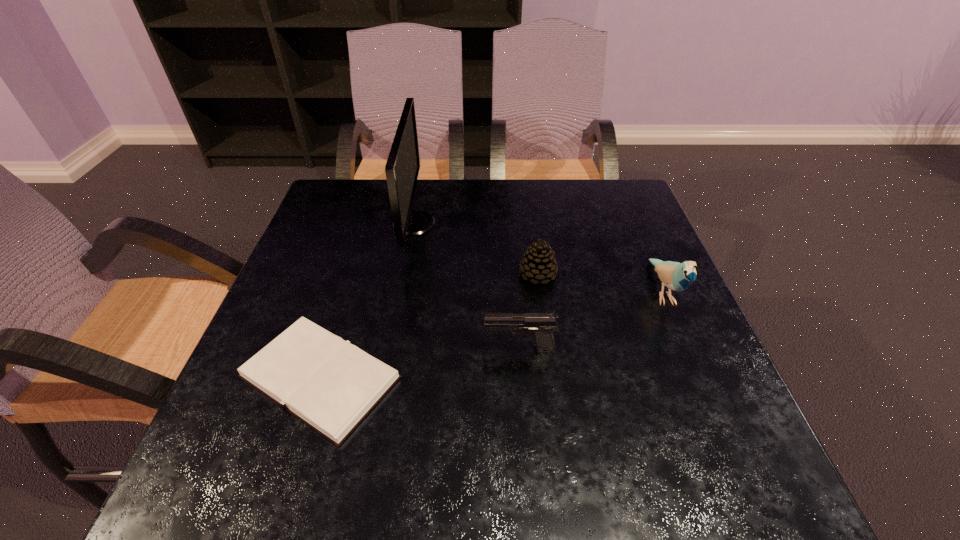
At what (x,y) coordinates should I click in order to perform the action: click on computer monitor. Please return your answer as a coordinate pair (x, y). The height and width of the screenshot is (540, 960). Looking at the image, I should click on (402, 168).

Where is `bird`? Image resolution: width=960 pixels, height=540 pixels. bird is located at coordinates (676, 276).

Where is `the second tallest object`? Image resolution: width=960 pixels, height=540 pixels. the second tallest object is located at coordinates 676,276.

Identify the location of pistol. The width and height of the screenshot is (960, 540). (542, 325).

At what (x,y) coordinates should I click in order to perform the action: click on pinecone. Please return your answer as a coordinate pair (x, y). This screenshot has width=960, height=540. Looking at the image, I should click on (x=539, y=263).

This screenshot has width=960, height=540. I want to click on hardback book, so click(x=331, y=385).

This screenshot has height=540, width=960. I want to click on vacant space located on the front-facing side of the tallest object, so click(x=454, y=223).

The height and width of the screenshot is (540, 960). I want to click on free space located at the face of the rightmost object, so click(752, 501).

The height and width of the screenshot is (540, 960). I want to click on blank space located aim along the barrel of the pistol, so click(335, 349).

Identify the location of blank space located 0.120m aim along the barrel of the pistol. (422, 349).